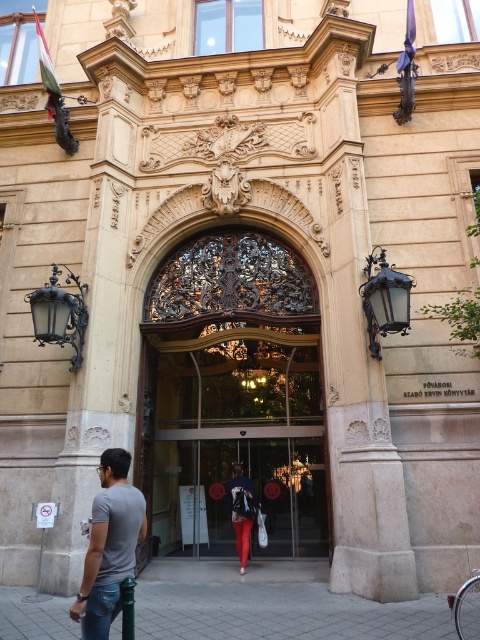
Question: Can you confirm if dark brown wrought iron door at center is wider than matte black backpack at center?

Choices:
 (A) no
 (B) yes

Answer: (B)

Question: Is dark brown wrought iron door at center below matte black backpack at center?

Choices:
 (A) yes
 (B) no

Answer: (B)

Question: Among these objects, which one is nearest to the camera?

Choices:
 (A) beige stone pillar at center
 (B) gray cotton t-shirt at lower left
 (C) dark brown wrought iron door at center
 (D) matte black backpack at center

Answer: (B)

Question: Estimate the real-world distances between objects in this image. Which object is farther from the matte black backpack at center?

Choices:
 (A) dark brown wrought iron door at center
 (B) beige stone pillar at center

Answer: (B)

Question: Considering the relative positions of dark brown wrought iron door at center and gray cotton t-shirt at lower left in the image provided, where is dark brown wrought iron door at center located with respect to gray cotton t-shirt at lower left?

Choices:
 (A) right
 (B) left

Answer: (A)

Question: Which of the following is the farthest from the observer?

Choices:
 (A) (66, 520)
 (B) (115, 524)

Answer: (A)